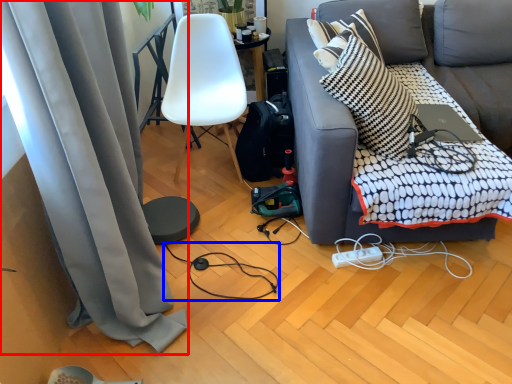
Question: Which point is closer to the camera, curtain (highlighted by a red box) or wire (highlighted by a blue box)?

Choices:
 (A) curtain
 (B) wire

Answer: (A)